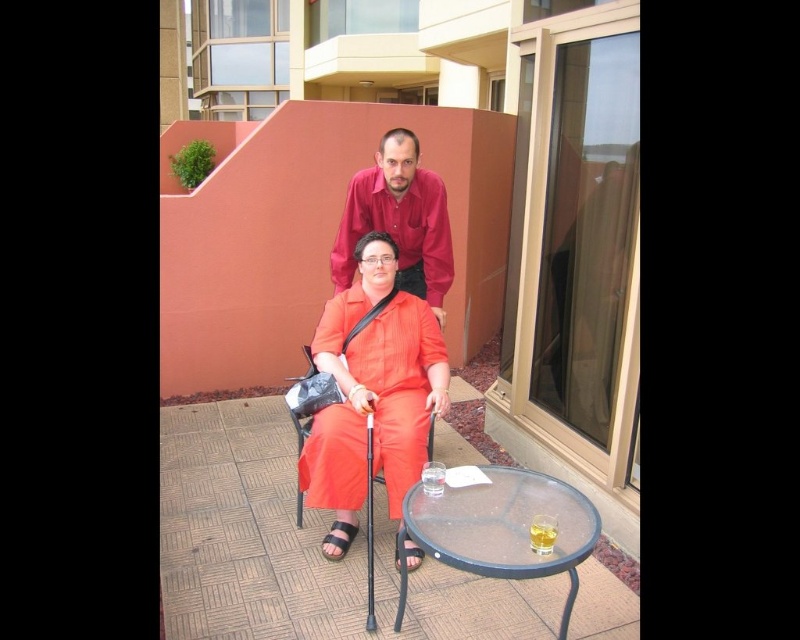
Question: Which object appears closest to the camera in this image?

Choices:
 (A) transparent glass table at lower center
 (B) matte orange fabric chair at center

Answer: (A)

Question: Is matte orange jumpsuit at center to the right of transparent glass table at lower center from the viewer's perspective?

Choices:
 (A) yes
 (B) no

Answer: (B)

Question: Which is farther from the matte orange fabric chair at center?

Choices:
 (A) transparent glass table at lower center
 (B) matte red shirt at upper center
 (C) matte orange jumpsuit at center

Answer: (A)

Question: Can you confirm if matte orange jumpsuit at center is wider than matte red shirt at upper center?

Choices:
 (A) no
 (B) yes

Answer: (A)

Question: Is matte orange jumpsuit at center above transparent glass table at lower center?

Choices:
 (A) no
 (B) yes

Answer: (B)

Question: Among these objects, which one is nearest to the camera?

Choices:
 (A) matte red shirt at upper center
 (B) transparent glass table at lower center
 (C) matte orange fabric chair at center
 (D) matte orange jumpsuit at center

Answer: (B)